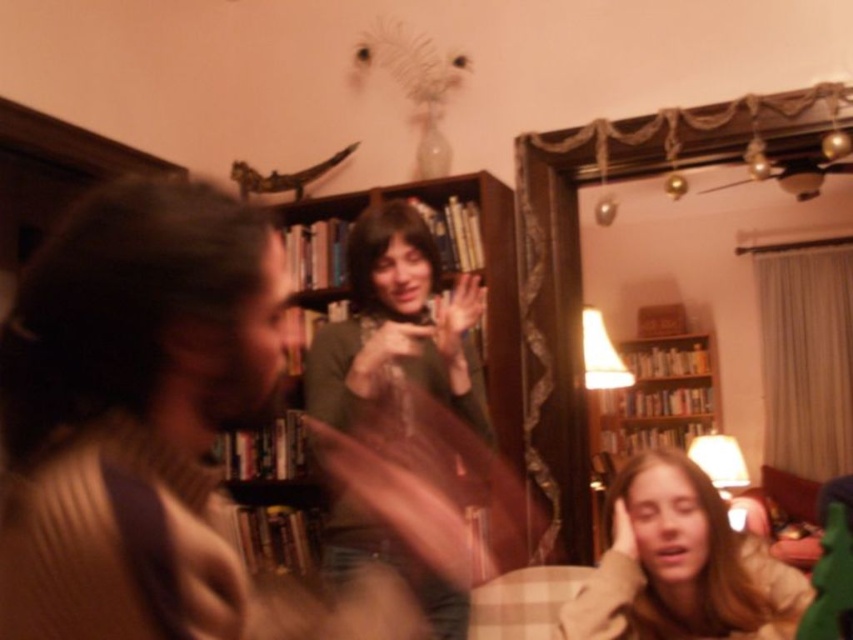
Question: Which point is farther to the camera?

Choices:
 (A) blonde hair at lower right
 (B) wooden bookshelf at center

Answer: (B)

Question: Does matte green sweater at center have a greater width compared to blonde hair at lower right?

Choices:
 (A) no
 (B) yes

Answer: (B)

Question: Is matte green sweater at center closer to camera compared to blonde hair at lower right?

Choices:
 (A) no
 (B) yes

Answer: (A)

Question: Is rough wool sweater at left to the left of matte green sweater at center from the viewer's perspective?

Choices:
 (A) yes
 (B) no

Answer: (A)

Question: Which point is farther to the camera?

Choices:
 (A) rough wool sweater at left
 (B) matte green sweater at center

Answer: (B)

Question: Among these points, which one is farthest from the camera?

Choices:
 (A) (119, 193)
 (B) (590, 419)

Answer: (B)